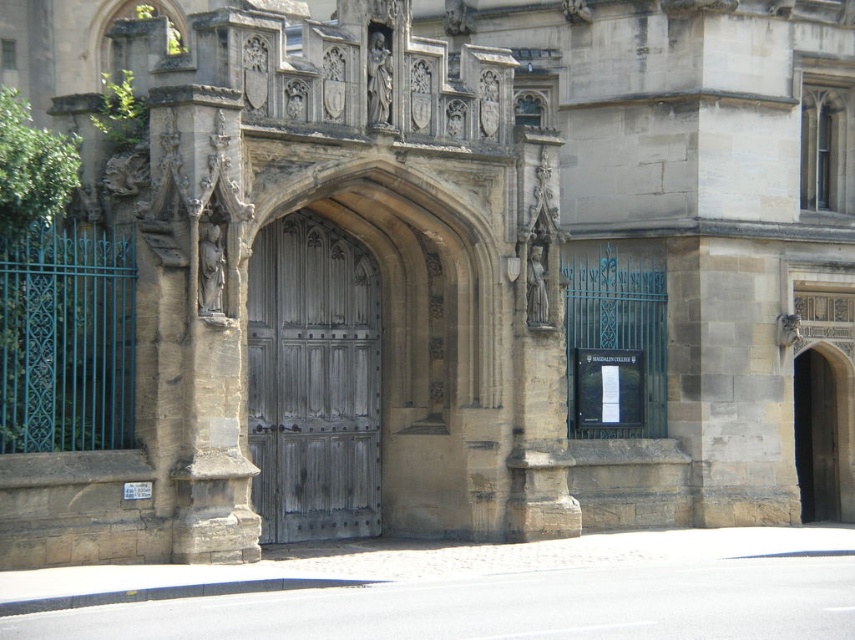
Question: Observing the image, what is the correct spatial positioning of wooden carved door at center in reference to weathered wood door at center?

Choices:
 (A) left
 (B) right

Answer: (B)

Question: Is wooden carved door at center bigger than weathered wood door at center?

Choices:
 (A) no
 (B) yes

Answer: (B)

Question: Which point is farther to the camera?

Choices:
 (A) (325, 444)
 (B) (321, 532)

Answer: (A)

Question: Where is wooden carved door at center located in relation to weathered wood door at center in the image?

Choices:
 (A) right
 (B) left

Answer: (A)